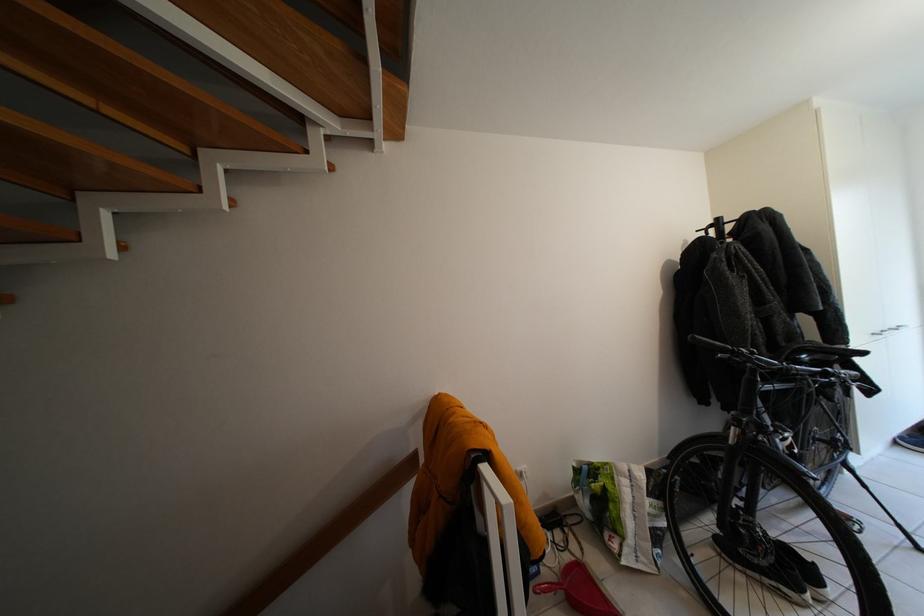
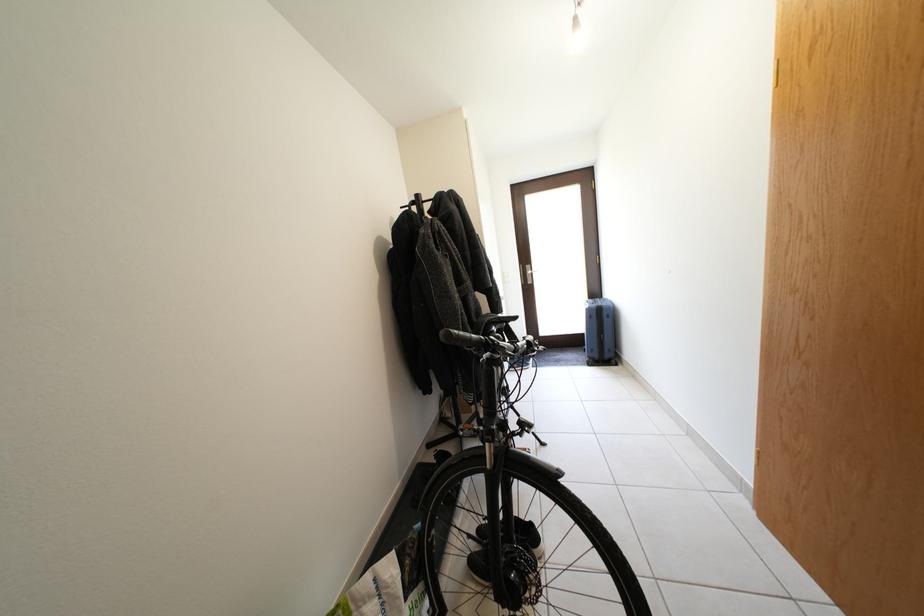
Question: The first image is from the beginning of the video and the second image is from the end. How did the camera likely rotate when shooting the video?

Choices:
 (A) Left
 (B) Right
 (C) Up
 (D) Down

Answer: (B)